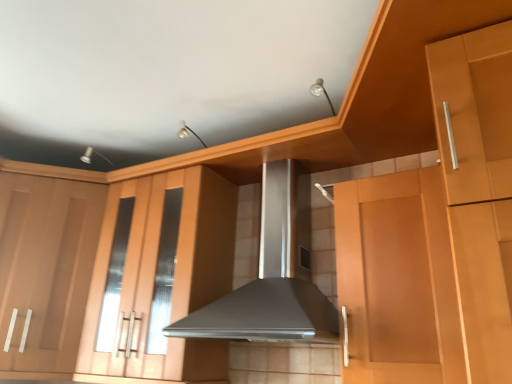
Question: Considering the positions of matte wood cabinet at left, positioned as the 1th cabinetry in left-to-right order, and matte wood cabinet at center, the second cabinetry positioned from the left, in the image, is matte wood cabinet at left, positioned as the 1th cabinetry in left-to-right order, taller or shorter than matte wood cabinet at center, the second cabinetry positioned from the left,?

Choices:
 (A) short
 (B) tall

Answer: (A)

Question: From a real-world perspective, is matte wood cabinet at left, arranged as the second cabinetry when viewed from the right, above or below matte wood cabinet at center, which is the first cabinetry in right-to-left order?

Choices:
 (A) above
 (B) below

Answer: (B)

Question: Which is nearer to the matte wood cabinet at left, arranged as the second cabinetry when viewed from the right?

Choices:
 (A) matte wood cabinet at center, which is the first cabinetry in right-to-left order
 (B) satin silver range hood at center

Answer: (A)

Question: Which object is the farthest from the satin silver range hood at center?

Choices:
 (A) matte wood cabinet at left, arranged as the second cabinetry when viewed from the right
 (B) matte wood cabinet at center, the second cabinetry positioned from the left

Answer: (A)